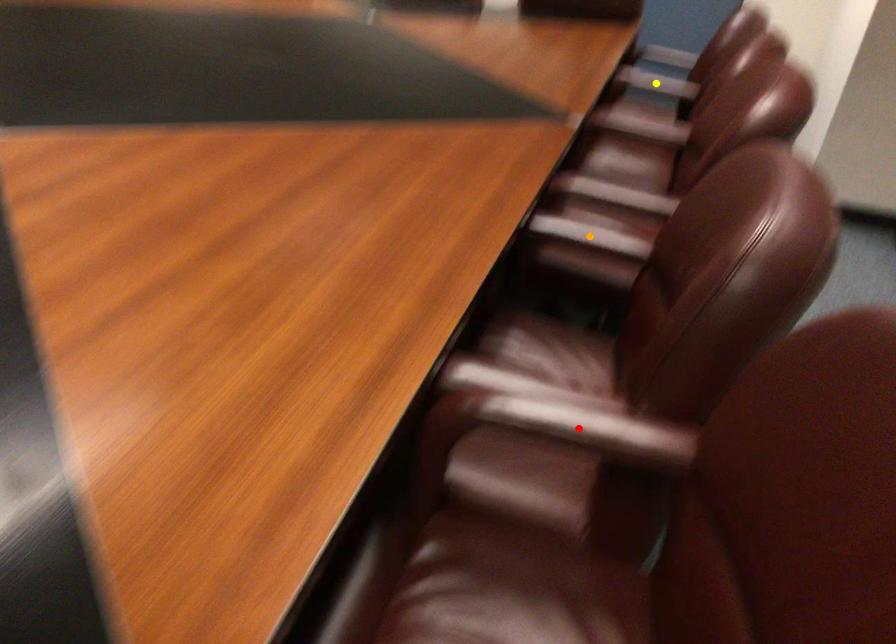
Order these from nearest to farthest:
yellow point, red point, orange point

yellow point < orange point < red point